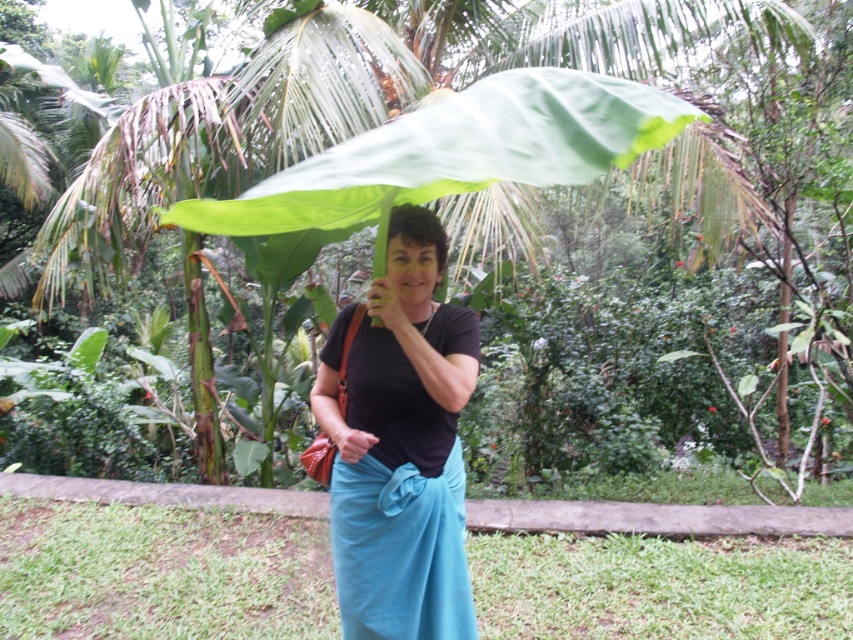
Question: Considering the real-world distances, which object is closest to the matte blue fabric at lower center?

Choices:
 (A) black matte shirt at center
 (B) green leafy umbrella at center

Answer: (A)

Question: Does green leafy umbrella at center have a lesser width compared to matte blue fabric at lower center?

Choices:
 (A) yes
 (B) no

Answer: (B)

Question: Does black matte shirt at center appear under green leafy umbrella at center?

Choices:
 (A) yes
 (B) no

Answer: (A)

Question: Does green leafy umbrella at center appear on the left side of matte blue fabric at lower center?

Choices:
 (A) no
 (B) yes

Answer: (A)

Question: Which of the following is the closest to the observer?

Choices:
 (A) (347, 467)
 (B) (466, 177)
 (C) (412, 486)

Answer: (B)

Question: Which object appears closest to the camera in this image?

Choices:
 (A) matte blue fabric at lower center
 (B) green leafy umbrella at center
 (C) black matte shirt at center

Answer: (B)